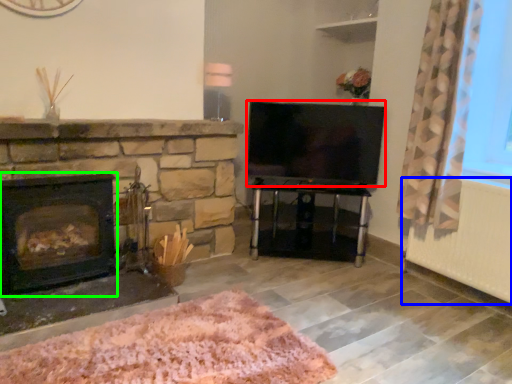
Question: Estimate the real-world distances between objects in this image. Which object is closer to television (highlighted by a red box), radiator (highlighted by a blue box) or wood burning stove (highlighted by a green box)?

Choices:
 (A) radiator
 (B) wood burning stove

Answer: (A)